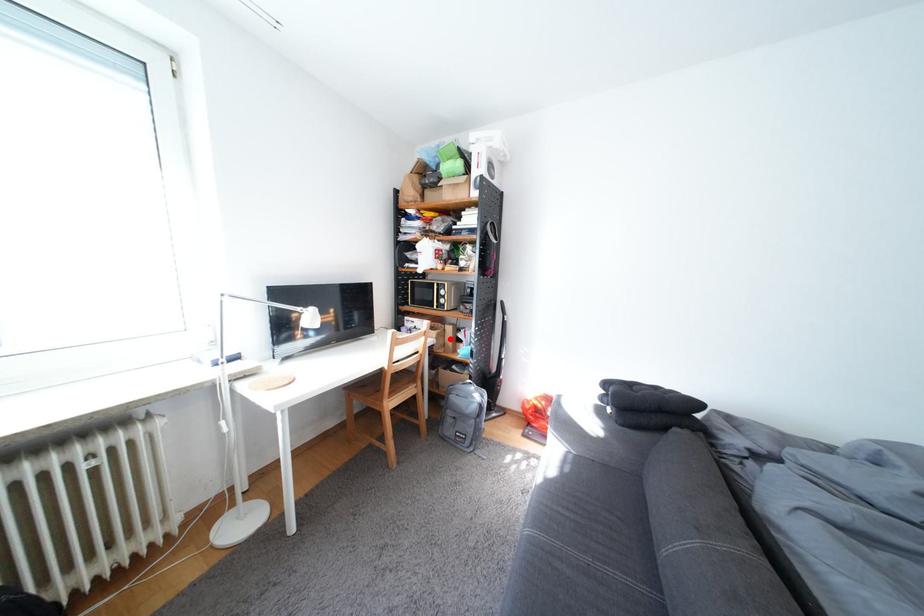
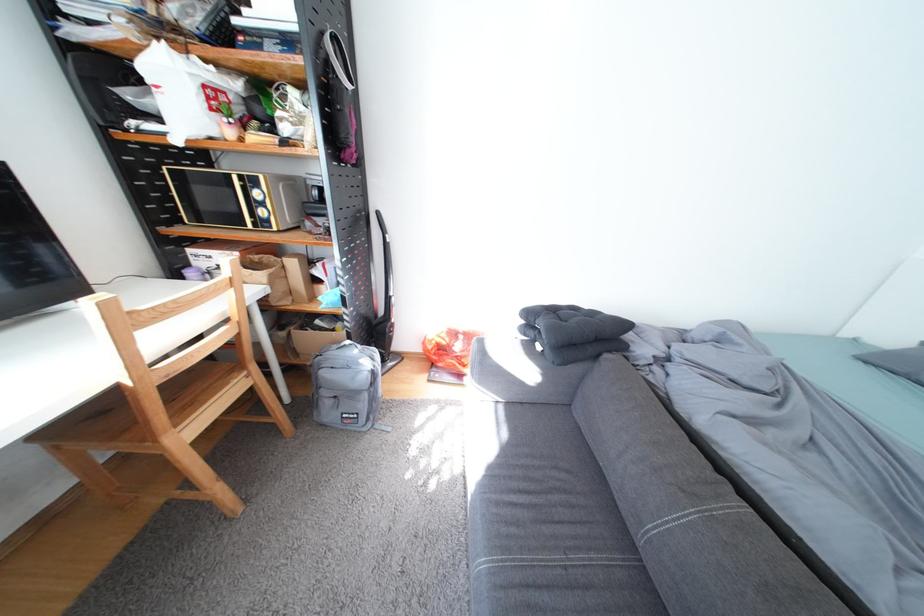
In the second image, find the point that corresponds to the highlighted location in the first image.

(285, 284)